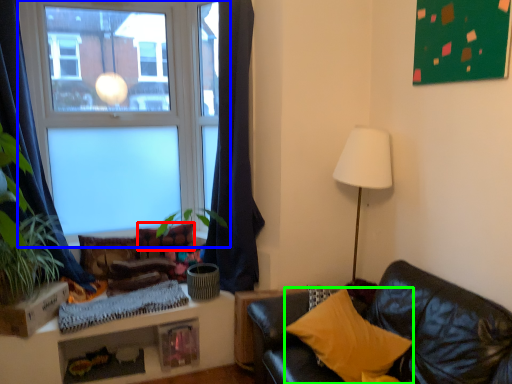
Question: Based on their relative distances, which object is nearer to pillow (highlighted by a red box)? Choose from window (highlighted by a blue box) and pillow (highlighted by a green box).

Choices:
 (A) window
 (B) pillow

Answer: (A)